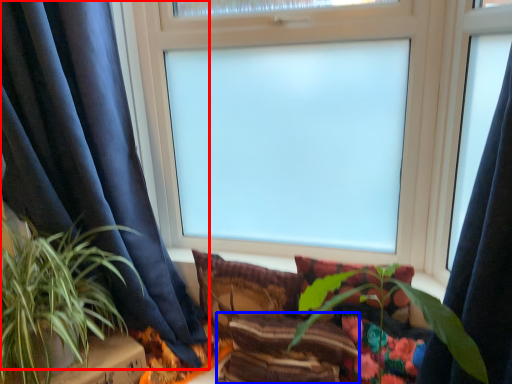
Question: Which object is further to the camera taking this photo, curtain (highlighted by a red box) or pillow (highlighted by a blue box)?

Choices:
 (A) curtain
 (B) pillow

Answer: (B)